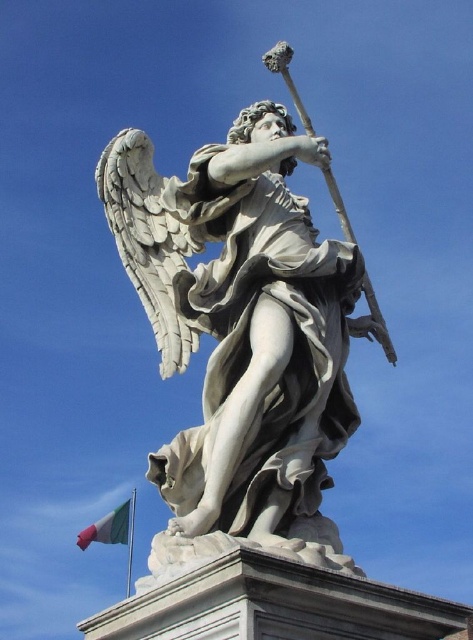
You are an art student analyzing the composition of the image. The white marble statue at center and the green fabric flag at lower left are both central to the scene. Based on their sizes, which one do you think dominates the visual hierarchy?

The white marble statue at center is taller than the green fabric flag at lower left, making it the dominant element in the visual hierarchy.

Consider the image. You are an art curator planning to display both the white marble statue at center and the green fabric flag at lower left in a gallery. Given their sizes, which object requires more horizontal space for proper display?

The white marble statue at center requires more horizontal space because its width surpasses that of the green fabric flag at lower left.

You are standing in front of a classical statue of an angelic figure. The statue is made of white marble and is positioned at the center of the scene. Can you determine the exact coordinates of the white marble statue at center?

The white marble statue at center is located at point (x=245, y=332).